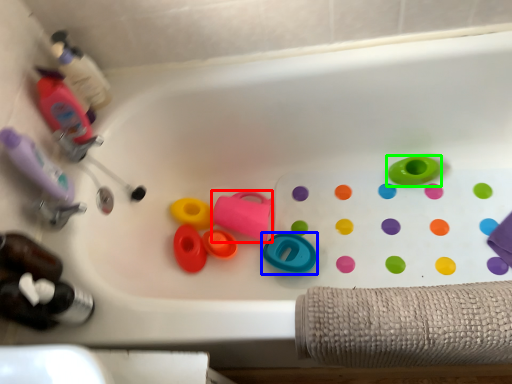
Question: Which object is the closest to the toy (highlighted by a red box)? Choose among these: toy (highlighted by a blue box) or toy (highlighted by a green box).

Choices:
 (A) toy
 (B) toy

Answer: (A)